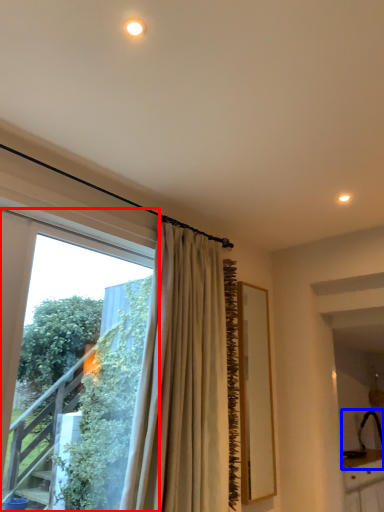
Question: Which object is further to the camera taking this photo, window (highlighted by a red box) or sink (highlighted by a blue box)?

Choices:
 (A) window
 (B) sink

Answer: (B)